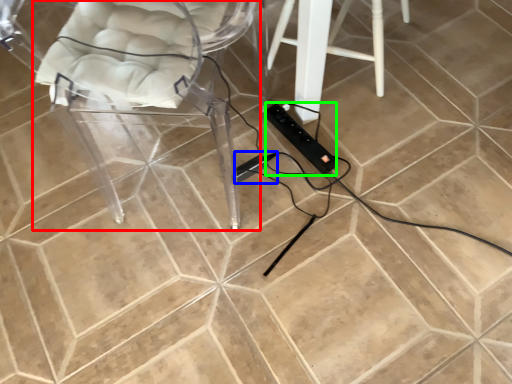
Question: Which object is the closest to the chair (highlighted by a red box)? Choose among these: extension cord (highlighted by a blue box) or extension cord (highlighted by a green box).

Choices:
 (A) extension cord
 (B) extension cord

Answer: (A)